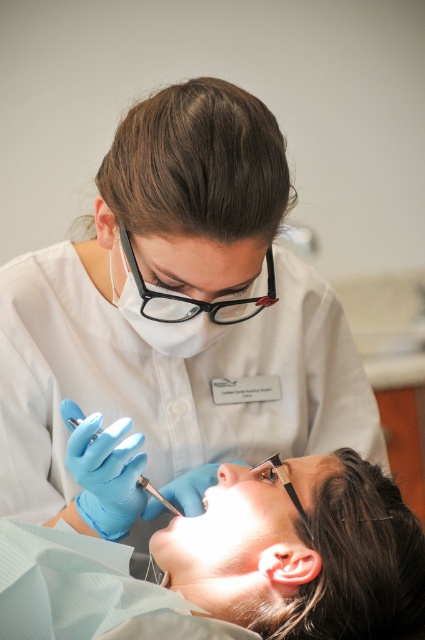
Question: In this image, where is matte blue gloves at lower left located relative to blue rubber gloves at left?

Choices:
 (A) below
 (B) above

Answer: (A)

Question: Which point is farther from the camera taking this photo?

Choices:
 (A) (62, 579)
 (B) (159, 499)

Answer: (B)

Question: Which point is farther from the camera taking this photo?

Choices:
 (A) (277, 632)
 (B) (99, 432)

Answer: (B)

Question: Can you confirm if matte blue gloves at lower left is bigger than blue rubber gloves at left?

Choices:
 (A) no
 (B) yes

Answer: (B)

Question: Can you confirm if matte blue gloves at lower left is positioned to the right of blue rubber gloves at left?

Choices:
 (A) no
 (B) yes

Answer: (B)